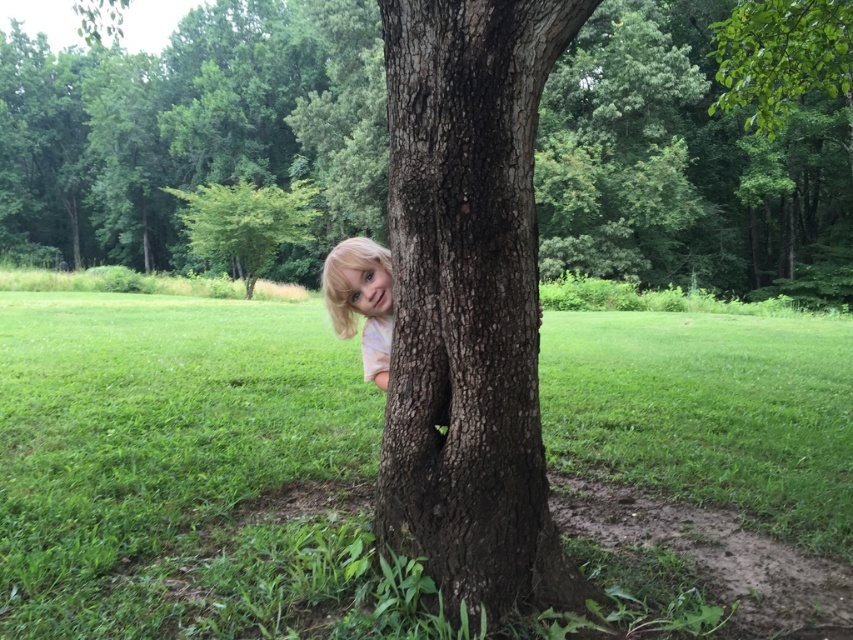
You are taking a photo of the scene and want to focus on both the point at point [39,228] and the point at point [376,276]. Which point should you adjust your focus to first to ensure both are in focus?

You should focus on point [376,276] first because it is closer to the camera than point [39,228]. By focusing on the closer point, the farther point will also be in focus due to the depth of field.

You are a gardener planning to plant a new flower bed between the brown rough bark tree at center and the green leafy bush at upper left. Considering their sizes, which plant should you avoid placing closer to ensure there is enough space?

You should avoid placing the brown rough bark tree at center closer to the flower bed since it is larger in size than the green leafy bush at upper left, requiring more space.

You are a photographer trying to capture a closeup of the blonde hair at tree while ensuring the brown rough bark tree at center is still visible in the background. Given the tree is wider than the hair, will you need to adjust your camera angle to include both?

The brown rough bark tree at center is wider than the blonde hair at tree, so you will need to adjust your camera angle to ensure both are visible in the frame.